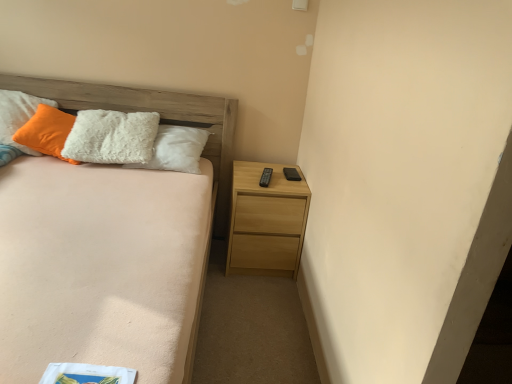
Question: From the image's perspective, is light brown wooden bed at left above or below light wood nightstand at lower right?

Choices:
 (A) below
 (B) above

Answer: (A)

Question: Is light brown wooden bed at left inside or outside of light wood nightstand at lower right?

Choices:
 (A) inside
 (B) outside

Answer: (B)

Question: Which is nearer to the light wood nightstand at lower right?

Choices:
 (A) light brown wooden bed at left
 (B) white fluffy pillow at upper left

Answer: (A)

Question: Considering the real-world distances, which object is farthest from the light brown wooden bed at left?

Choices:
 (A) light wood nightstand at lower right
 (B) white fluffy pillow at upper left

Answer: (A)